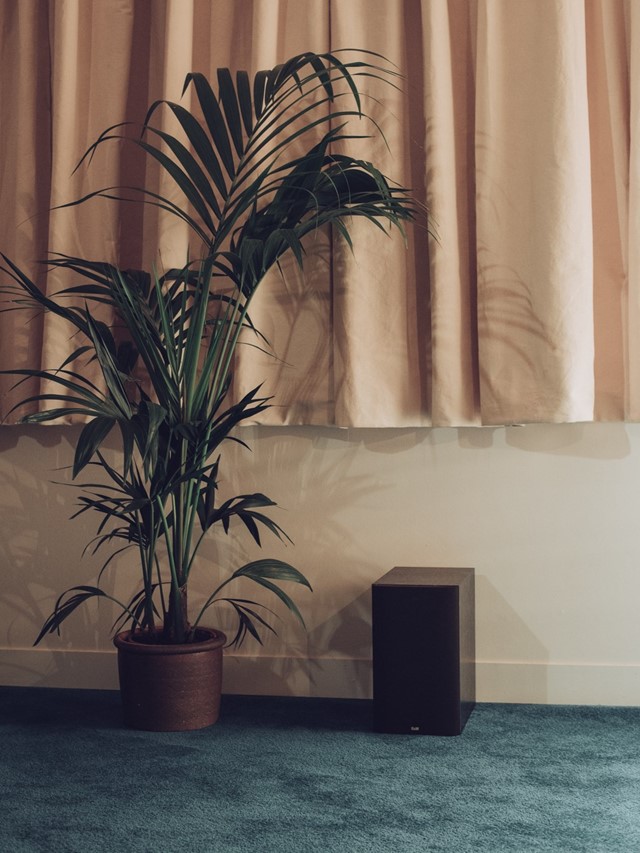
Where is `floor`? The image size is (640, 853). floor is located at coordinates (283, 763).